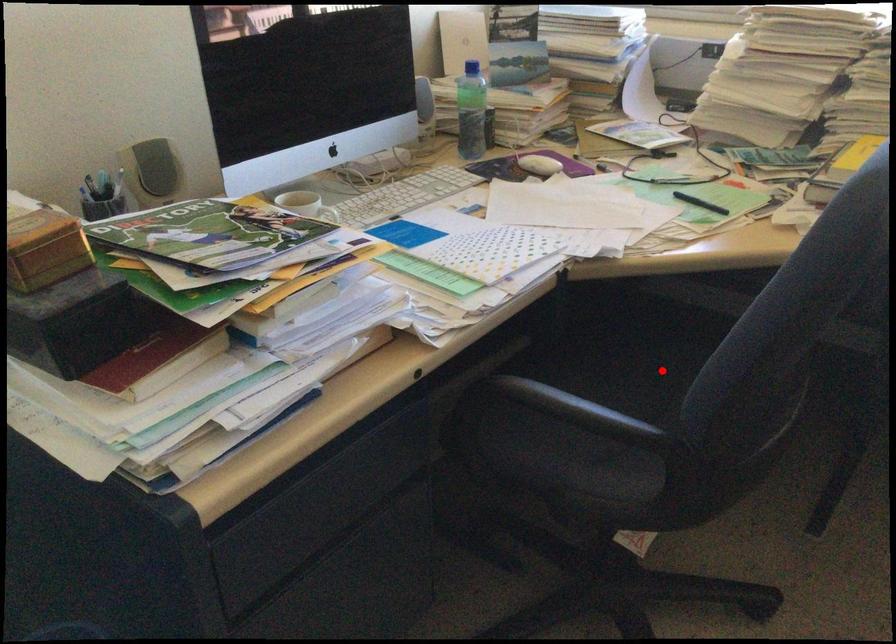
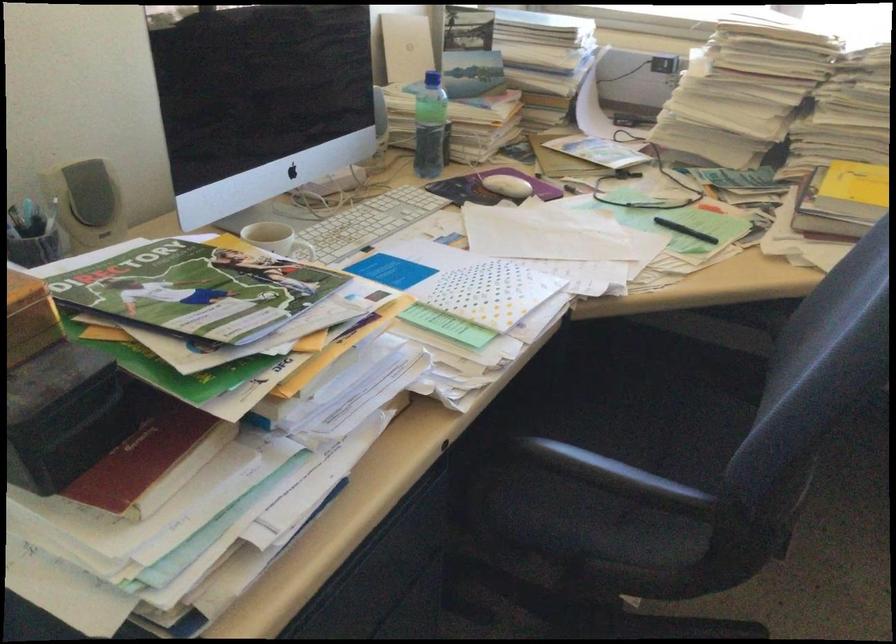
The point at the highlighted location is marked in the first image. Where is the corresponding point in the second image?

(653, 411)